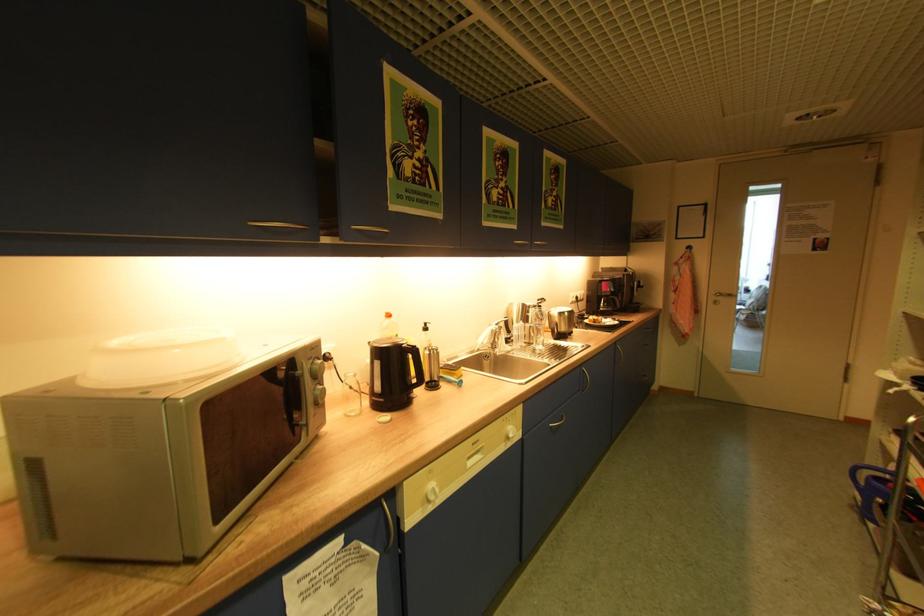
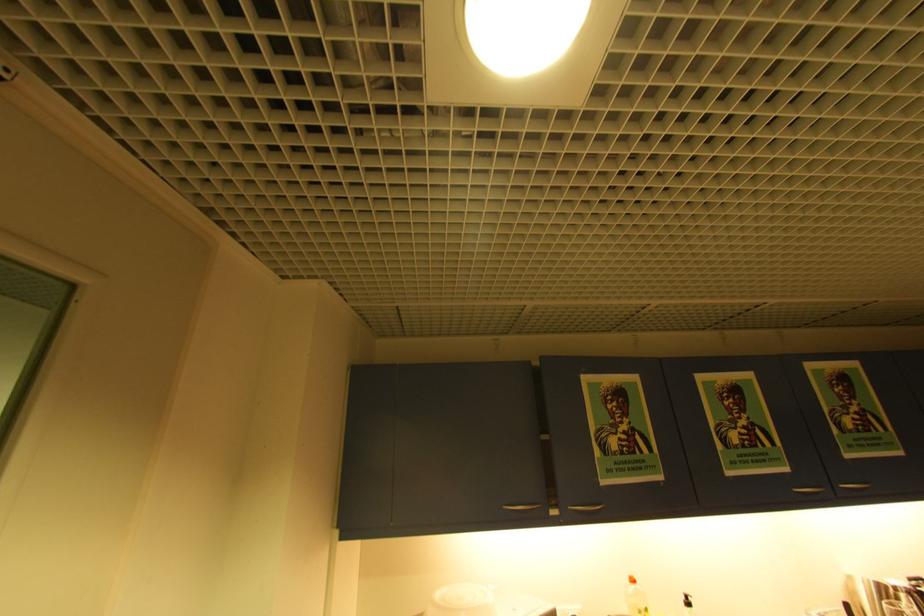
In the second image, find the point that corresponds to (390,315) in the first image.

(634, 578)